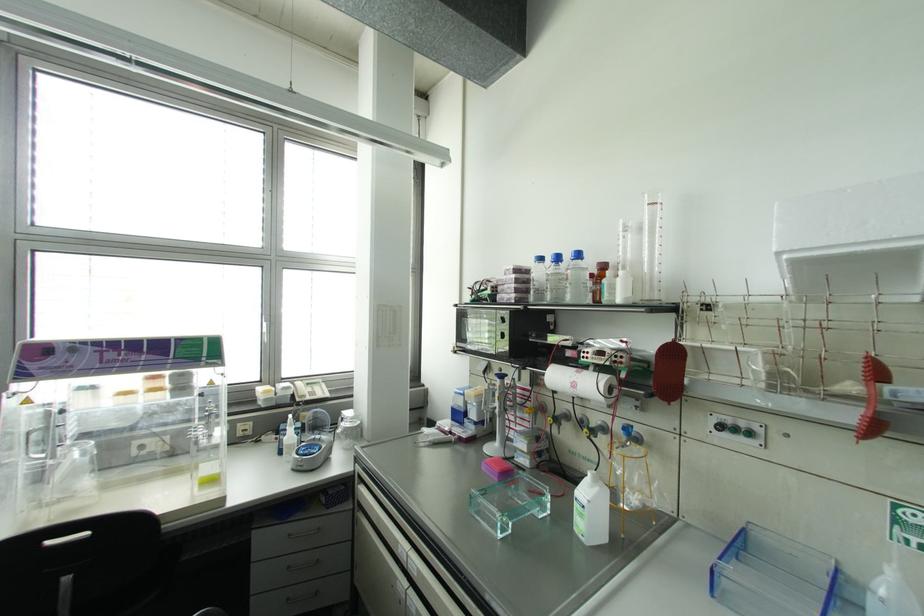
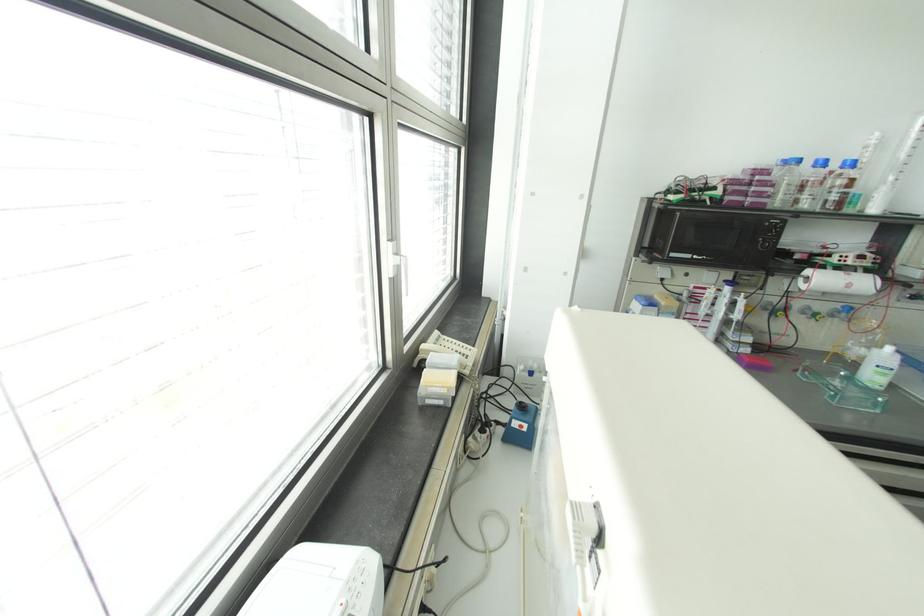
In the second image, find the point that corresponds to the point at 596,488 in the first image.

(898, 355)